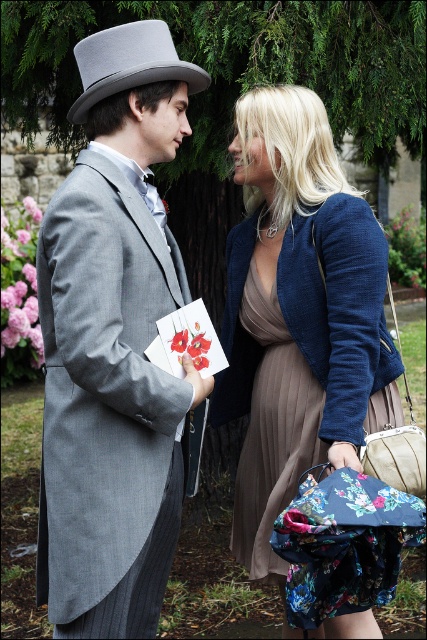
Between matte blue blazer at center and gray felt top hat at upper left, which one appears on the left side from the viewer's perspective?

gray felt top hat at upper left

Is matte blue blazer at center taller than gray felt top hat at upper left?

Yes.

Who is more forward, [304,241] or [202,88]?

Point [202,88] is more forward.

Where is `matte blue blazer at center`? This screenshot has width=427, height=640. matte blue blazer at center is located at coordinates (298, 316).

Between gray wool top hat at upper left and matte blue blazer at center, which one has less height?

gray wool top hat at upper left is shorter.

Does gray wool top hat at upper left have a lesser height compared to matte blue blazer at center?

Yes, gray wool top hat at upper left is shorter than matte blue blazer at center.

Is point (50, 556) closer to camera compared to point (359, 401)?

That is True.

At what (x,y) coordinates should I click in order to perform the action: click on gray wool top hat at upper left. Please return your answer as a coordinate pair (x, y). Looking at the image, I should click on (114, 346).

Can you confirm if gray wool top hat at upper left is bigger than gray felt top hat at upper left?

Indeed, gray wool top hat at upper left has a larger size compared to gray felt top hat at upper left.

Does gray wool top hat at upper left appear over gray felt top hat at upper left?

Incorrect, gray wool top hat at upper left is not positioned above gray felt top hat at upper left.

Where is `gray wool top hat at upper left`? Image resolution: width=427 pixels, height=640 pixels. gray wool top hat at upper left is located at coordinates (114, 346).